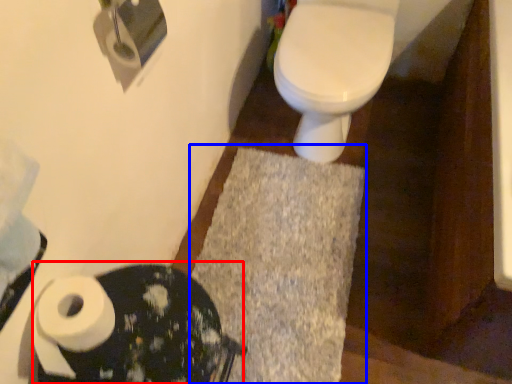
Question: Which object appears closest to the camera in this image, porcelain (highlighted by a red box) or bath mat (highlighted by a blue box)?

Choices:
 (A) porcelain
 (B) bath mat

Answer: (A)